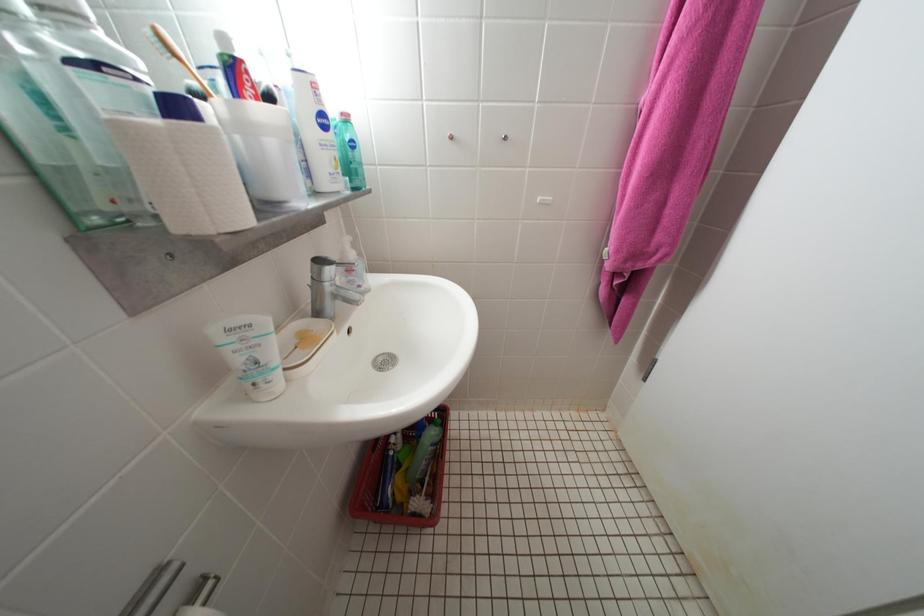
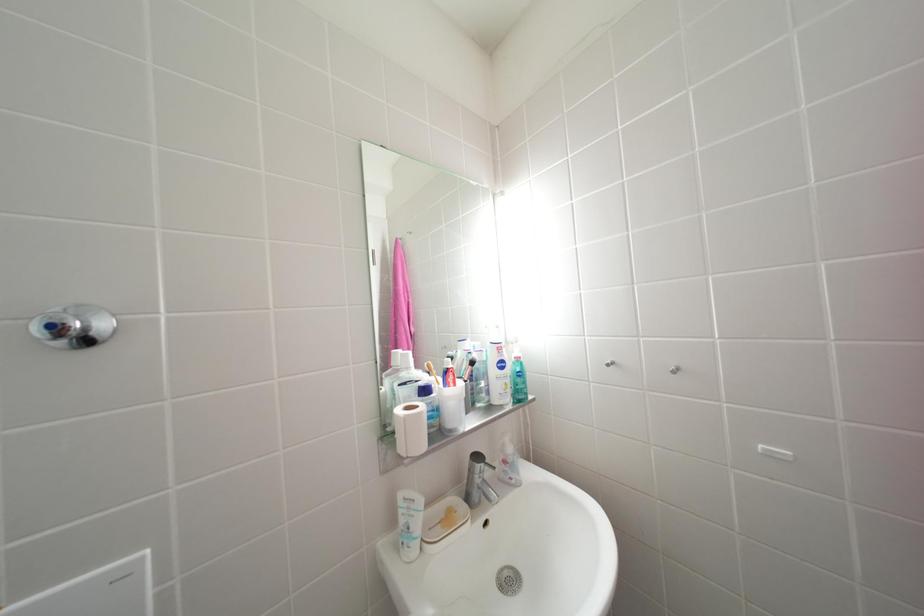
The first image is from the beginning of the video and the second image is from the end. How did the camera likely rotate when shooting the video?

The camera rotated toward left-up.